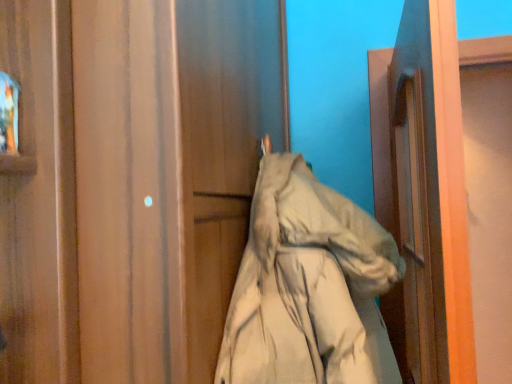
Question: Is matte wood door at center outside of beige fabric coat at center?

Choices:
 (A) no
 (B) yes

Answer: (B)

Question: Can you confirm if matte wood door at center is positioned to the left of beige fabric coat at center?

Choices:
 (A) no
 (B) yes

Answer: (B)

Question: Is matte wood door at center positioned behind beige fabric coat at center?

Choices:
 (A) yes
 (B) no

Answer: (B)

Question: Considering the relative positions of matte wood door at center and beige fabric coat at center in the image provided, is matte wood door at center in front of beige fabric coat at center?

Choices:
 (A) yes
 (B) no

Answer: (A)

Question: Would you say matte wood door at center contains beige fabric coat at center?

Choices:
 (A) no
 (B) yes

Answer: (A)

Question: From a real-world perspective, is printed fabric at upper left above or below beige fabric coat at center?

Choices:
 (A) above
 (B) below

Answer: (A)

Question: Looking at their shapes, would you say printed fabric at upper left is wider or thinner than beige fabric coat at center?

Choices:
 (A) wide
 (B) thin

Answer: (B)

Question: Considering the positions of point (9, 124) and point (233, 314), is point (9, 124) closer or farther from the camera than point (233, 314)?

Choices:
 (A) closer
 (B) farther

Answer: (A)

Question: Based on their sizes in the image, would you say printed fabric at upper left is bigger or smaller than beige fabric coat at center?

Choices:
 (A) small
 (B) big

Answer: (A)

Question: In terms of height, does beige fabric coat at center look taller or shorter compared to printed fabric at upper left?

Choices:
 (A) short
 (B) tall

Answer: (B)

Question: Is point (297, 259) positioned closer to the camera than point (12, 86)?

Choices:
 (A) farther
 (B) closer

Answer: (A)

Question: Which is correct: beige fabric coat at center is inside printed fabric at upper left, or outside of it?

Choices:
 (A) outside
 (B) inside

Answer: (A)

Question: Based on their sizes in the image, would you say beige fabric coat at center is bigger or smaller than printed fabric at upper left?

Choices:
 (A) small
 (B) big

Answer: (B)

Question: Would you say matte wood door at center is to the left or to the right of printed fabric at upper left in the picture?

Choices:
 (A) left
 (B) right

Answer: (B)

Question: Relative to printed fabric at upper left, is matte wood door at center in front or behind?

Choices:
 (A) behind
 (B) front

Answer: (B)